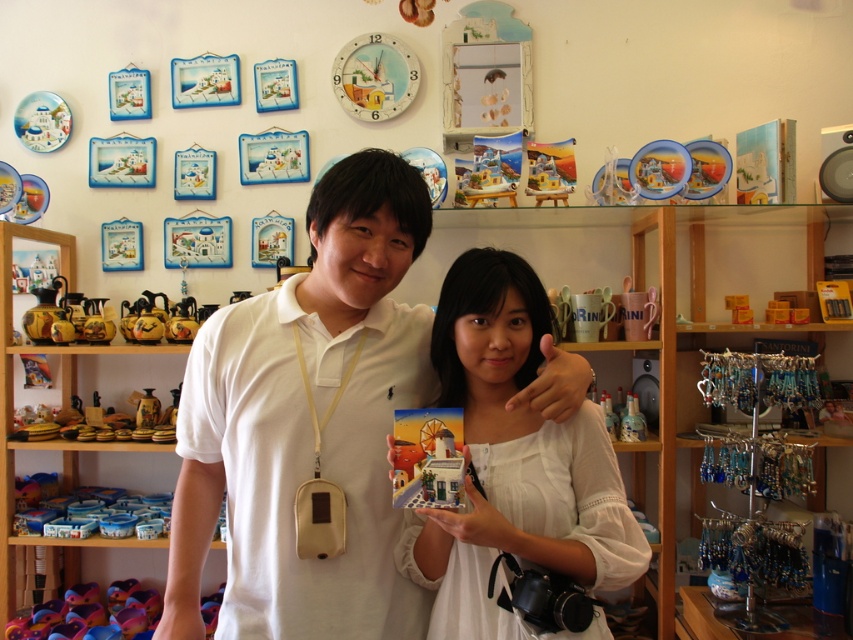
Question: Is white matte shirt at center bigger than white matte card at center?

Choices:
 (A) no
 (B) yes

Answer: (B)

Question: Is white matte shirt at center positioned before white matte card at center?

Choices:
 (A) yes
 (B) no

Answer: (B)

Question: Which point is farther from the camera taking this photo?

Choices:
 (A) (181, 560)
 (B) (508, 627)

Answer: (A)

Question: Which point is closer to the camera taking this photo?

Choices:
 (A) (457, 342)
 (B) (235, 388)

Answer: (A)

Question: Which of the following is the closest to the observer?

Choices:
 (A) (570, 440)
 (B) (399, 218)

Answer: (B)

Question: From the image, what is the correct spatial relationship of white matte shirt at center in relation to white matte card at center?

Choices:
 (A) right
 (B) left

Answer: (B)